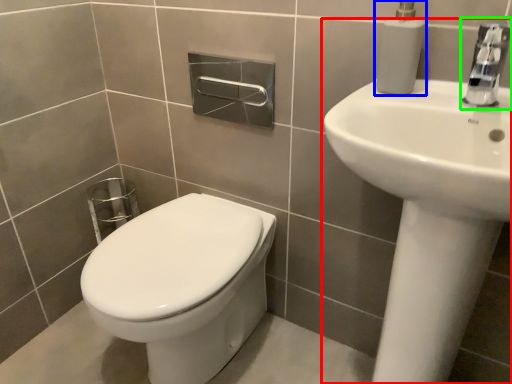
Question: Which object is the closest to the sink (highlighted by a red box)? Choose among these: soap dispenser (highlighted by a blue box) or tap (highlighted by a green box).

Choices:
 (A) soap dispenser
 (B) tap

Answer: (B)